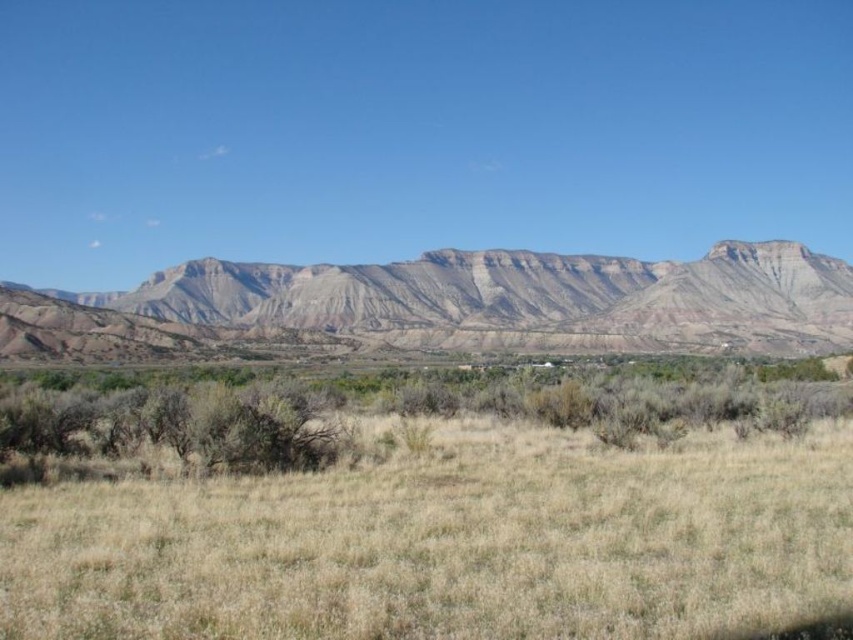
Looking at this image, you are standing on the left side of the image and want to walk towards the dry grassland at center. Which direction should you head relative to the rustic rock mountain range at center?

You should head to the right relative to the rustic rock mountain range at center because the dry grassland at center is located to the right of it.

You are standing at the origin point in the image. Which direction should you move to reach the dry grassland at center?

The dry grassland at center is located at point 0.795 on the x axis and 0.503 on the y axis. Since you are at the origin point, you should move towards the right and slightly forward to reach it.